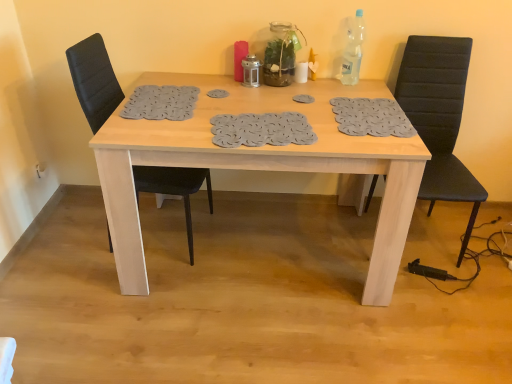
Identify the location of free space underneath black leather chair at right, arranged as the 2th chair when viewed from the left (from a real-world perspective). (419, 241).